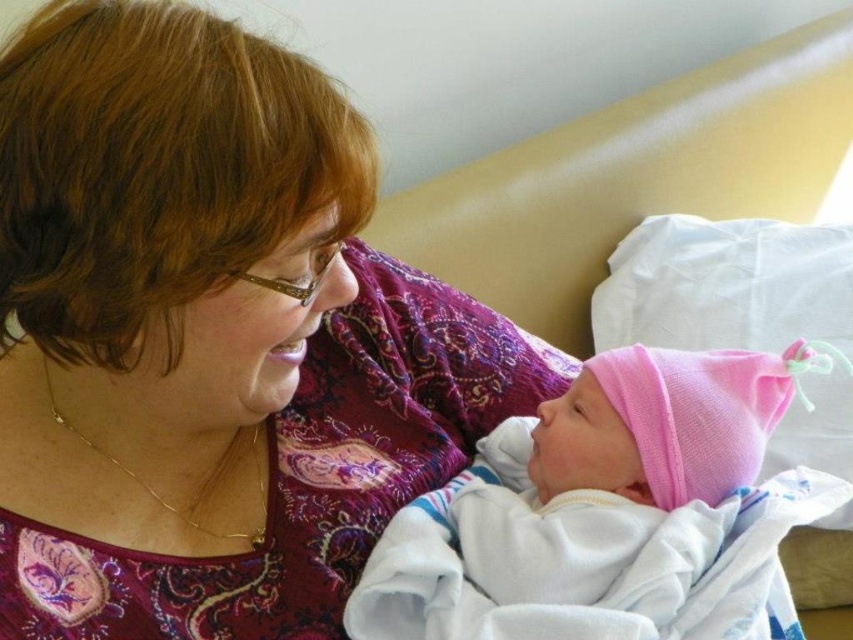
Question: Where is matte purple blouse at center located in relation to pink fabric hat at center in the image?

Choices:
 (A) left
 (B) right

Answer: (A)

Question: Observing the image, what is the correct spatial positioning of matte purple blouse at center in reference to pink fabric hat at center?

Choices:
 (A) left
 (B) right

Answer: (A)

Question: Does matte purple blouse at center come in front of pink fabric hat at center?

Choices:
 (A) yes
 (B) no

Answer: (A)

Question: Which point is farther from the camera taking this photo?

Choices:
 (A) (140, 531)
 (B) (769, 365)

Answer: (B)

Question: Which object is farther from the camera taking this photo?

Choices:
 (A) matte purple blouse at center
 (B) pink fabric hat at center

Answer: (B)

Question: Among these points, which one is nearest to the camera?

Choices:
 (A) (715, 577)
 (B) (107, 294)

Answer: (B)